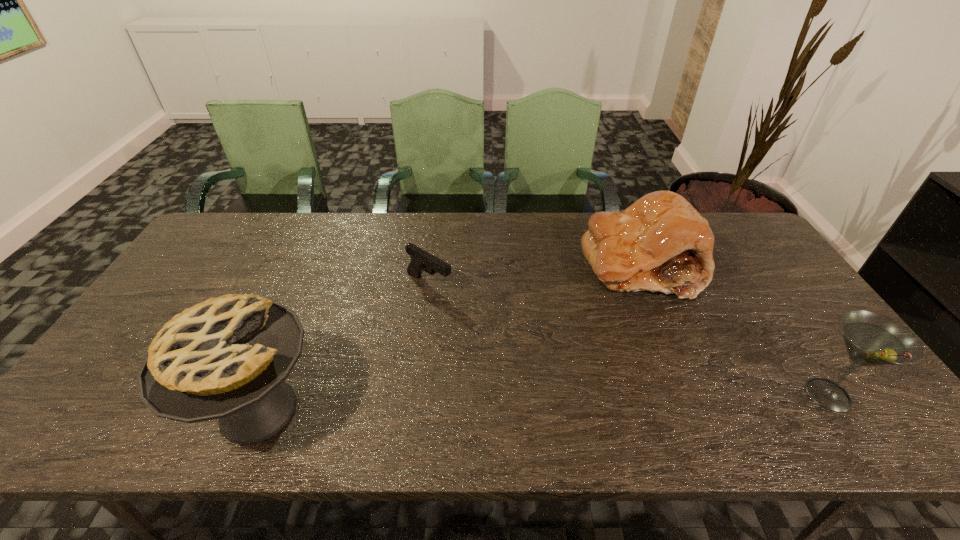
Find the location of `vacant space situated 0.300m on the filling side of the second object from right to left`. vacant space situated 0.300m on the filling side of the second object from right to left is located at coordinates (575, 367).

This screenshot has width=960, height=540. Identify the location of vacant space situated on the filling side of the second object from right to left. (571, 373).

You are a GUI agent. You are given a task and a screenshot of the screen. Output one action in this format:
    pyautogui.click(x=<x>, y=<y>)
    Task: Click on the object at the far edge
    The height and width of the screenshot is (540, 960).
    Given the screenshot: What is the action you would take?
    pyautogui.click(x=661, y=243)

Identify the location of pie present at the near edge. (226, 358).

At what (x,y) coordinates should I click in order to perform the action: click on martini at the near edge. Please return your answer as a coordinate pair (x, y). Looking at the image, I should click on (871, 339).

The height and width of the screenshot is (540, 960). Identify the location of object that is at the right edge. (x=871, y=339).

The width and height of the screenshot is (960, 540). I want to click on object positioned at the near right corner, so click(x=871, y=339).

This screenshot has height=540, width=960. In the image, there is a desktop. Find the location of `vacant space at the far edge`. vacant space at the far edge is located at coordinates (346, 240).

Locate an element on the screen. The image size is (960, 540). free space at the near edge of the desktop is located at coordinates (482, 400).

In the image, there is a desktop. Where is `vacant space at the left edge`? Image resolution: width=960 pixels, height=540 pixels. vacant space at the left edge is located at coordinates (218, 292).